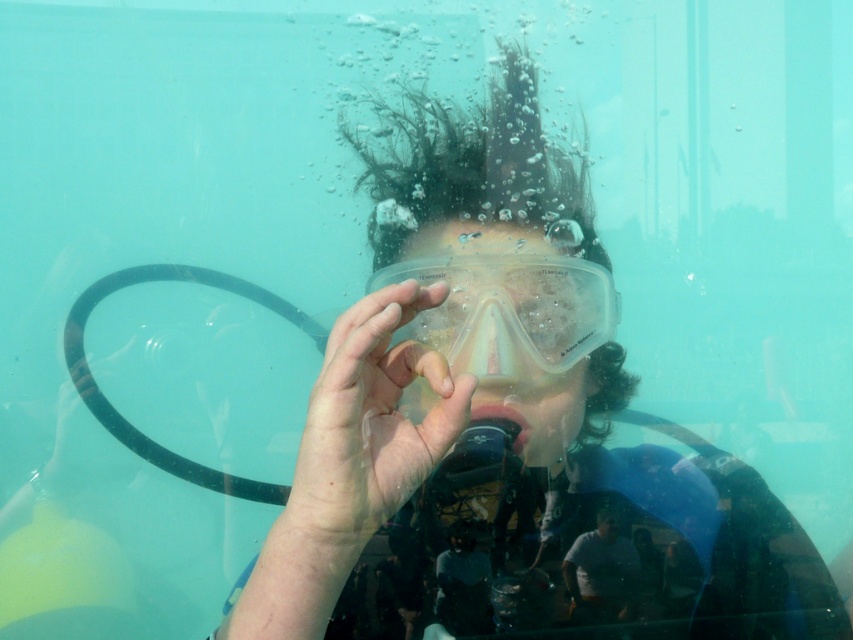
Question: Does transparent plastic goggles at center have a greater width compared to gray matte shirt at center?

Choices:
 (A) yes
 (B) no

Answer: (A)

Question: Among these objects, which one is farthest from the camera?

Choices:
 (A) transparent plastic hand at center
 (B) gray matte shirt at center

Answer: (B)

Question: Considering the relative positions of transparent plastic hand at center and transparent plastic goggles at center in the image provided, where is transparent plastic hand at center located with respect to transparent plastic goggles at center?

Choices:
 (A) above
 (B) below

Answer: (B)

Question: Does transparent plastic hand at center appear on the right side of gray matte shirt at center?

Choices:
 (A) no
 (B) yes

Answer: (A)

Question: Which object is positioned closest to the transparent plastic hand at center?

Choices:
 (A) transparent plastic goggles at center
 (B) gray matte shirt at center

Answer: (A)

Question: Which object is farther from the camera taking this photo?

Choices:
 (A) gray matte shirt at center
 (B) transparent plastic goggles at center

Answer: (A)